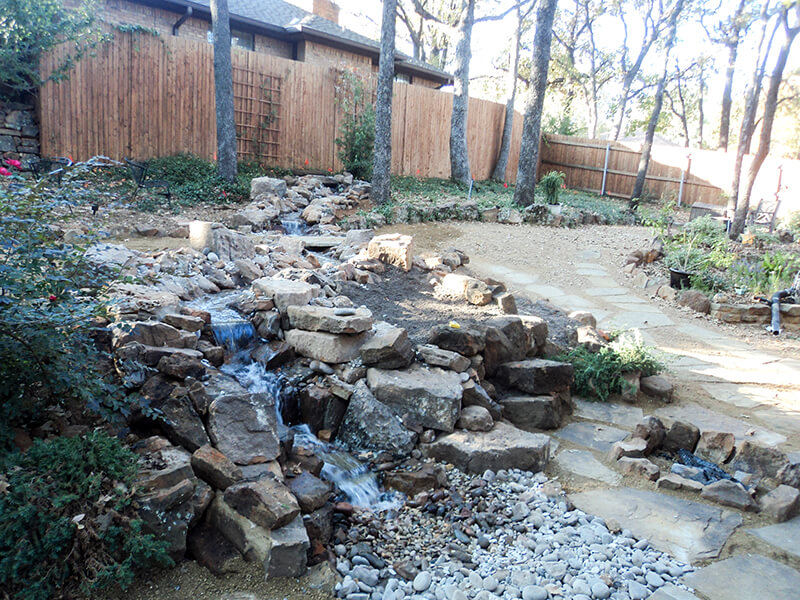
Where is `window`? Image resolution: width=800 pixels, height=600 pixels. window is located at coordinates (240, 37).